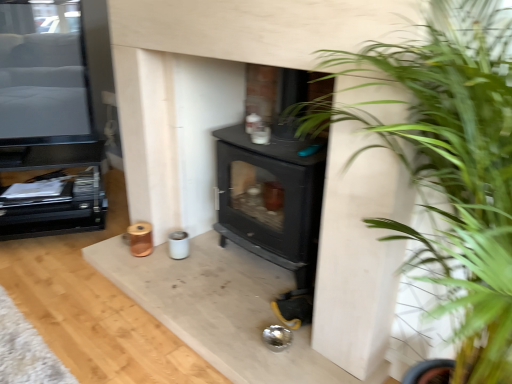
Question: Is black glossy tv at upper left, placed as the 1th entertainment center when sorted from top to bottom, outside of green leafy plant at center right?

Choices:
 (A) no
 (B) yes

Answer: (B)

Question: Is black glossy tv at upper left, positioned as the 2th entertainment center in bottom-to-top order, taller than green leafy plant at center right?

Choices:
 (A) yes
 (B) no

Answer: (B)

Question: Is black glossy tv at upper left, placed as the 1th entertainment center when sorted from top to bottom, touching green leafy plant at center right?

Choices:
 (A) yes
 (B) no

Answer: (B)

Question: Are black glossy tv at upper left, placed as the 1th entertainment center when sorted from top to bottom, and green leafy plant at center right located far from each other?

Choices:
 (A) yes
 (B) no

Answer: (A)

Question: Is black glossy tv at upper left, placed as the 1th entertainment center when sorted from top to bottom, in front of green leafy plant at center right?

Choices:
 (A) yes
 (B) no

Answer: (B)

Question: Is point (413, 155) closer or farther from the camera than point (9, 155)?

Choices:
 (A) farther
 (B) closer

Answer: (B)

Question: Considering the positions of green leafy plant at center right and black matte entertainment center at left, marked as the first entertainment center in a bottom-to-top arrangement, in the image, is green leafy plant at center right bigger or smaller than black matte entertainment center at left, marked as the first entertainment center in a bottom-to-top arrangement,?

Choices:
 (A) small
 (B) big

Answer: (B)

Question: Is green leafy plant at center right in front of or behind black matte entertainment center at left, which is counted as the second entertainment center, starting from the top, in the image?

Choices:
 (A) behind
 (B) front

Answer: (B)

Question: Is green leafy plant at center right inside or outside of black matte entertainment center at left, which is counted as the second entertainment center, starting from the top?

Choices:
 (A) outside
 (B) inside

Answer: (A)

Question: Looking at their shapes, would you say black matte entertainment center at left, marked as the first entertainment center in a bottom-to-top arrangement, is wider or thinner than green leafy plant at center right?

Choices:
 (A) thin
 (B) wide

Answer: (A)

Question: Is black matte entertainment center at left, which is counted as the second entertainment center, starting from the top, in front of or behind green leafy plant at center right in the image?

Choices:
 (A) front
 (B) behind

Answer: (B)

Question: From their relative heights in the image, would you say black matte entertainment center at left, marked as the first entertainment center in a bottom-to-top arrangement, is taller or shorter than green leafy plant at center right?

Choices:
 (A) tall
 (B) short

Answer: (B)

Question: Considering the relative positions of black matte entertainment center at left, marked as the first entertainment center in a bottom-to-top arrangement, and green leafy plant at center right in the image provided, is black matte entertainment center at left, marked as the first entertainment center in a bottom-to-top arrangement, to the left or to the right of green leafy plant at center right?

Choices:
 (A) right
 (B) left

Answer: (B)

Question: Visually, is black glossy tv at upper left, positioned as the 2th entertainment center in bottom-to-top order, positioned to the left or to the right of green leafy plant at center right?

Choices:
 (A) right
 (B) left

Answer: (B)

Question: Is black glossy tv at upper left, placed as the 1th entertainment center when sorted from top to bottom, taller or shorter than green leafy plant at center right?

Choices:
 (A) short
 (B) tall

Answer: (A)